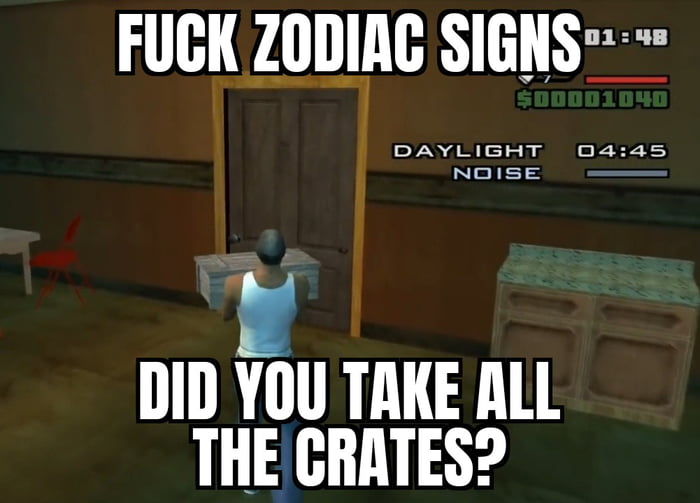
Image resolution: width=700 pixels, height=503 pixels. I want to click on folding chair, so click(x=56, y=263).